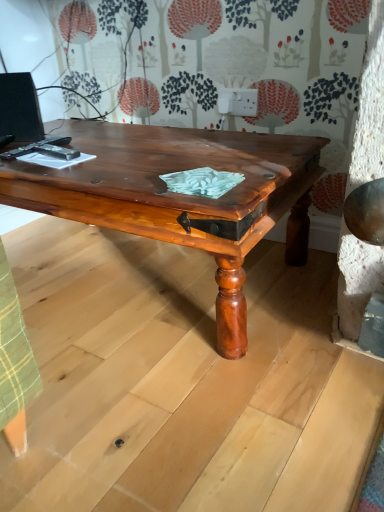
Question: In terms of width, does shiny brown wood coffee table at center look wider or thinner when compared to matte black monitor at upper left?

Choices:
 (A) thin
 (B) wide

Answer: (B)

Question: From their relative heights in the image, would you say shiny brown wood coffee table at center is taller or shorter than matte black monitor at upper left?

Choices:
 (A) tall
 (B) short

Answer: (A)

Question: Considering their positions, is shiny brown wood coffee table at center located in front of or behind matte black monitor at upper left?

Choices:
 (A) front
 (B) behind

Answer: (A)

Question: From their relative heights in the image, would you say matte black monitor at upper left is taller or shorter than shiny brown wood coffee table at center?

Choices:
 (A) short
 (B) tall

Answer: (A)

Question: Is matte black monitor at upper left wider or thinner than shiny brown wood coffee table at center?

Choices:
 (A) wide
 (B) thin

Answer: (B)

Question: Is matte black monitor at upper left spatially inside shiny brown wood coffee table at center, or outside of it?

Choices:
 (A) outside
 (B) inside

Answer: (A)

Question: Is point (21, 119) positioned closer to the camera than point (112, 217)?

Choices:
 (A) closer
 (B) farther

Answer: (B)